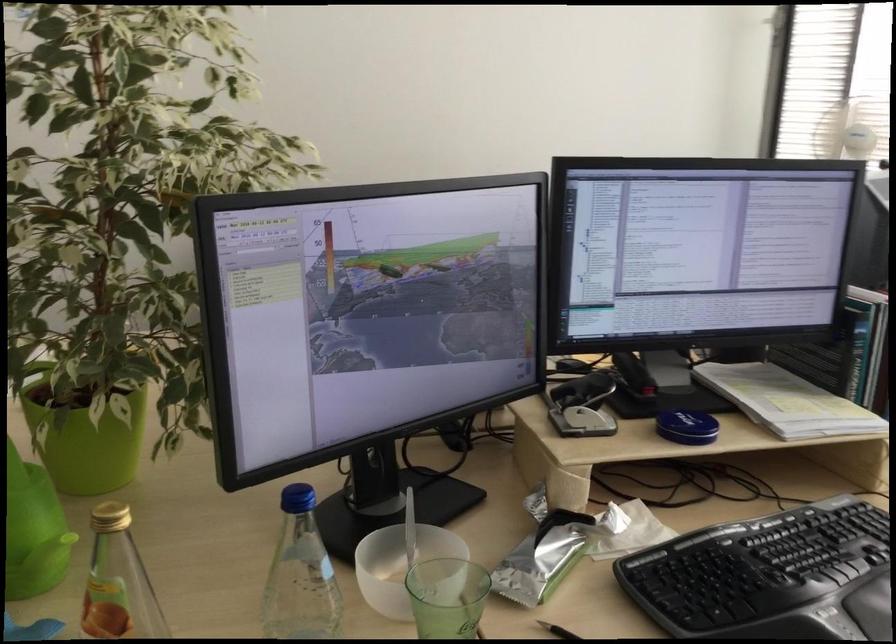
I want to click on stapler lever, so click(x=583, y=391).